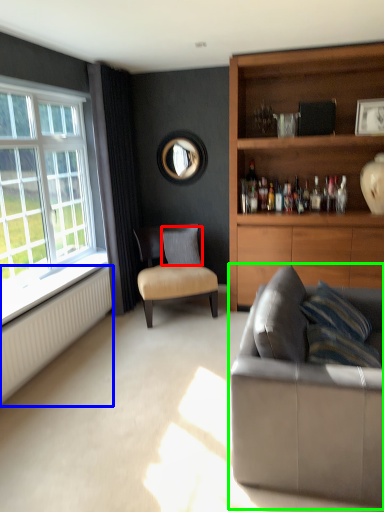
Question: Considering the real-world distances, which object is closest to pillow (highlighted by a red box)? radiator (highlighted by a blue box) or studio couch (highlighted by a green box).

Choices:
 (A) radiator
 (B) studio couch

Answer: (A)